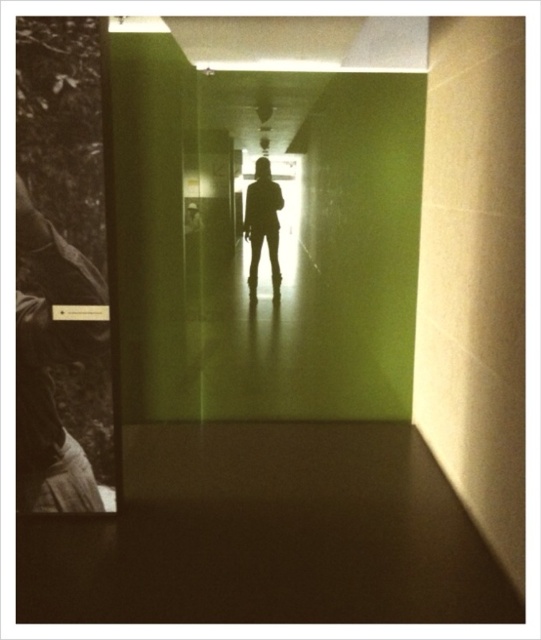
Question: Which object appears farthest from the camera in this image?

Choices:
 (A) sepia-toned photograph of man at left
 (B) silhouette figure at center

Answer: (B)

Question: Does sepia-toned photograph of man at left come in front of silhouette figure at center?

Choices:
 (A) yes
 (B) no

Answer: (A)

Question: Is sepia-toned photograph of man at left above silhouette figure at center?

Choices:
 (A) no
 (B) yes

Answer: (A)

Question: Does sepia-toned photograph of man at left have a larger size compared to silhouette figure at center?

Choices:
 (A) no
 (B) yes

Answer: (B)

Question: Which object appears farthest from the camera in this image?

Choices:
 (A) silhouette figure at center
 (B) sepia-toned photograph of man at left

Answer: (A)